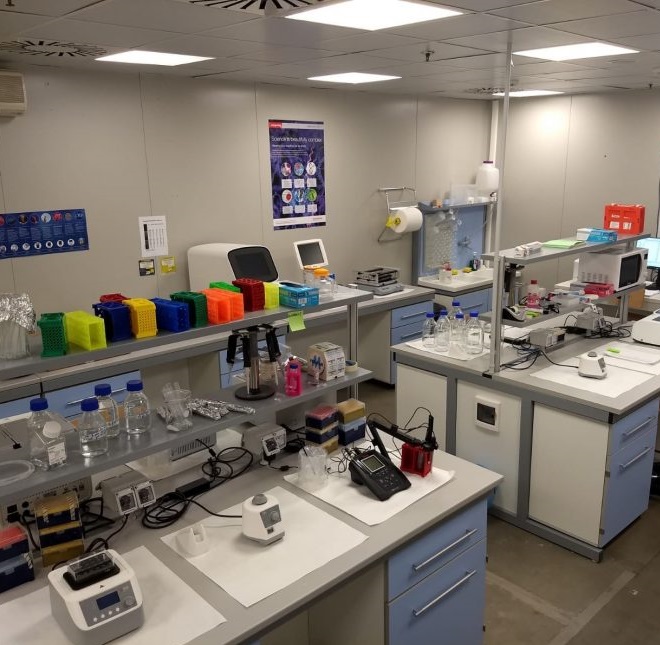
Identify the location of counter tops. The height and width of the screenshot is (645, 660). (476, 364), (519, 375), (432, 513).